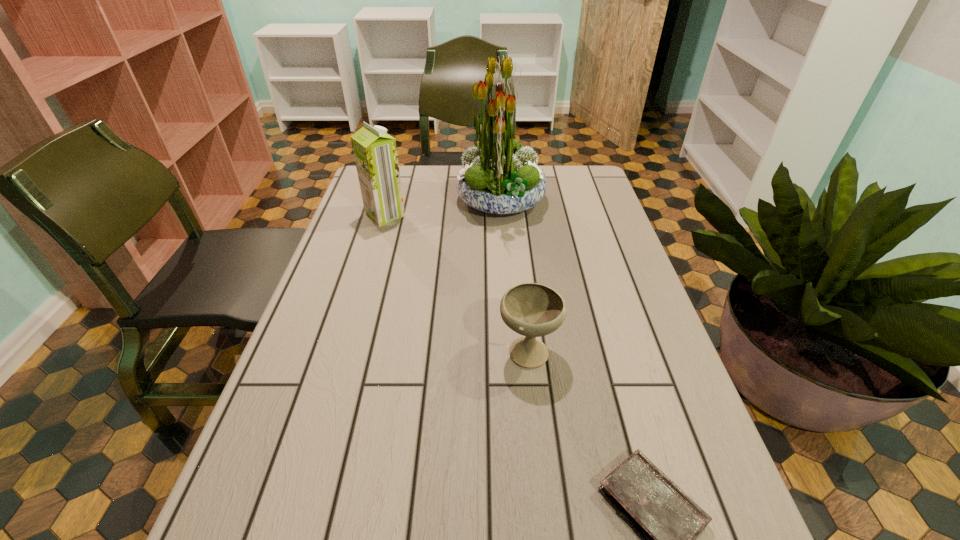
The height and width of the screenshot is (540, 960). In order to click on object positioned at the far edge in this screenshot , I will do `click(499, 176)`.

Where is `object that is at the left edge`? object that is at the left edge is located at coordinates (375, 152).

Where is `blank area at the far edge`? Image resolution: width=960 pixels, height=540 pixels. blank area at the far edge is located at coordinates (445, 185).

I want to click on vacant space at the left edge of the desktop, so click(x=310, y=418).

Image resolution: width=960 pixels, height=540 pixels. Identify the location of vacant region at the right edge of the desktop. (597, 289).

Find the location of a particular element. Image resolution: width=960 pixels, height=540 pixels. vacant space at the far right corner is located at coordinates (578, 198).

At what (x,y) coordinates should I click in order to perform the action: click on empty space between the flower arrangement and the third tallest object. Please return your answer as a coordinate pair (x, y). Looking at the image, I should click on (515, 275).

What are the coordinates of `free area in between the tallest object and the leftmost object` in the screenshot? It's located at (443, 208).

The width and height of the screenshot is (960, 540). Identify the location of free space between the soya milk and the flower arrangement. (443, 208).

Locate an element on the screen. The height and width of the screenshot is (540, 960). free space between the leftmost object and the flower arrangement is located at coordinates [x=443, y=208].